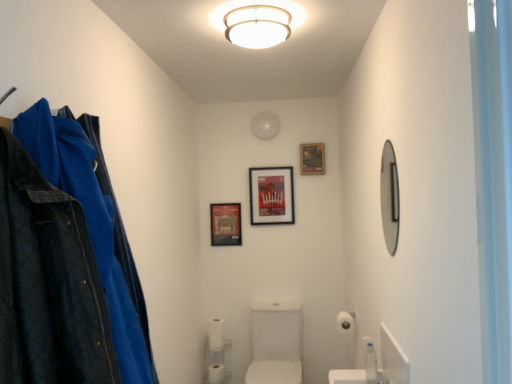
Question: Which direction should I rotate to face matte black picture frame at upper center, placed as the third picture frame when sorted from left to right, — up or down?

Choices:
 (A) up
 (B) down

Answer: (A)

Question: Can you confirm if white matte ceiling light at upper center is shorter than silver metallic mirror at right?

Choices:
 (A) yes
 (B) no

Answer: (A)

Question: Can you confirm if white matte ceiling light at upper center is smaller than silver metallic mirror at right?

Choices:
 (A) yes
 (B) no

Answer: (B)

Question: Is white matte ceiling light at upper center at the right side of silver metallic mirror at right?

Choices:
 (A) no
 (B) yes

Answer: (A)

Question: Considering the relative sizes of white matte ceiling light at upper center and silver metallic mirror at right in the image provided, is white matte ceiling light at upper center taller than silver metallic mirror at right?

Choices:
 (A) no
 (B) yes

Answer: (A)

Question: From the image's perspective, is white matte ceiling light at upper center below silver metallic mirror at right?

Choices:
 (A) yes
 (B) no

Answer: (B)

Question: Would you consider white matte ceiling light at upper center to be distant from silver metallic mirror at right?

Choices:
 (A) no
 (B) yes

Answer: (A)

Question: Considering the relative positions of matte black picture frame at upper center, placed as the third picture frame when sorted from left to right, and white glossy sink at center in the image provided, is matte black picture frame at upper center, placed as the third picture frame when sorted from left to right, to the left of white glossy sink at center from the viewer's perspective?

Choices:
 (A) no
 (B) yes

Answer: (A)

Question: Considering the relative sizes of matte black picture frame at upper center, placed as the third picture frame when sorted from left to right, and white glossy sink at center in the image provided, is matte black picture frame at upper center, placed as the third picture frame when sorted from left to right, bigger than white glossy sink at center?

Choices:
 (A) no
 (B) yes

Answer: (A)

Question: From a real-world perspective, is matte black picture frame at upper center, placed as the third picture frame when sorted from left to right, physically below white glossy sink at center?

Choices:
 (A) yes
 (B) no

Answer: (B)

Question: From the image's perspective, is matte black picture frame at upper center, placed as the third picture frame when sorted from left to right, over white glossy sink at center?

Choices:
 (A) yes
 (B) no

Answer: (A)

Question: Is matte black picture frame at upper center, placed as the third picture frame when sorted from left to right, wider than white glossy sink at center?

Choices:
 (A) yes
 (B) no

Answer: (B)

Question: Is matte black picture frame at upper center, placed as the third picture frame when sorted from left to right, located outside white glossy sink at center?

Choices:
 (A) yes
 (B) no

Answer: (A)

Question: Is white glossy sink at center oriented towards white matte toilet paper at lower center, which ranks as the third toilet paper in front-to-back order?

Choices:
 (A) no
 (B) yes

Answer: (A)